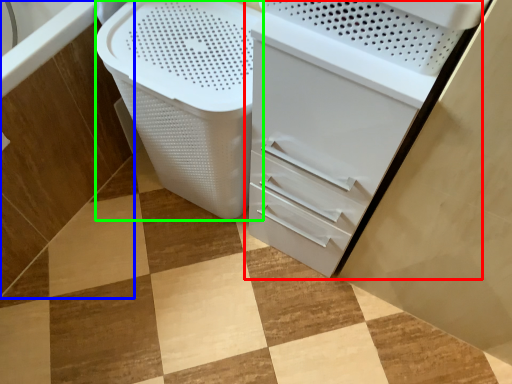
Question: Considering the real-world distances, which object is closest to file cabinet (highlighted by a red box)? bath (highlighted by a blue box) or laundry basket (highlighted by a green box).

Choices:
 (A) bath
 (B) laundry basket

Answer: (B)